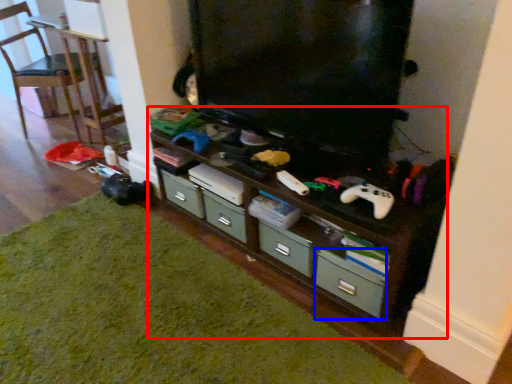
Question: Among these objects, which one is nearest to the camera, shelf (highlighted by a red box) or drawer (highlighted by a blue box)?

Choices:
 (A) shelf
 (B) drawer

Answer: (A)